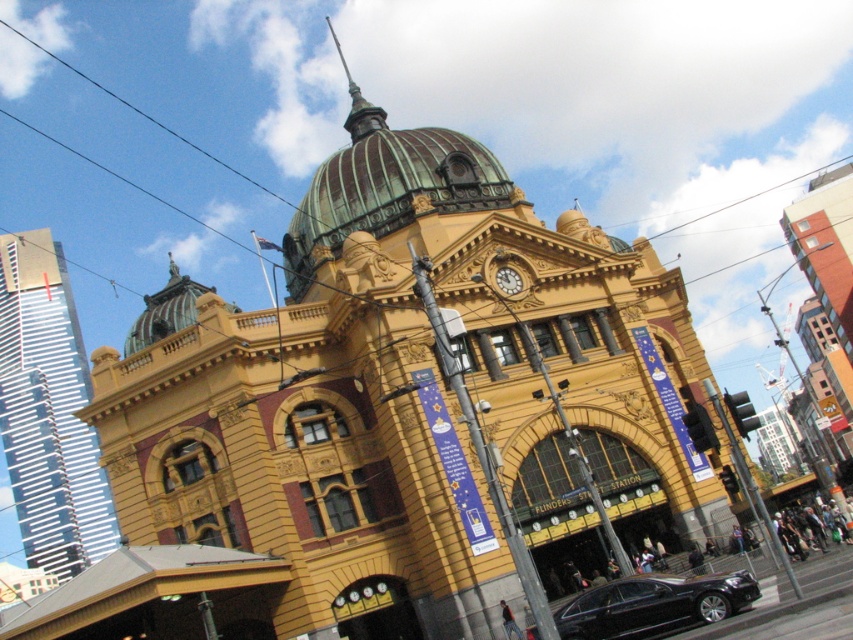
Who is positioned more to the right, green glass dome at upper center or gold metallic clock at center?

From the viewer's perspective, gold metallic clock at center appears more on the right side.

Can you confirm if green glass dome at upper center is thinner than gold metallic clock at center?

A: No, green glass dome at upper center is not thinner than gold metallic clock at center.

Between point (181, 321) and point (514, 269), which one is positioned in front?

Point (514, 269) is in front.

Locate an element on the screen. green glass dome at upper center is located at coordinates (165, 310).

Can you confirm if white glass skyscraper at left is positioned to the right of gold metallic clock at center?

No, white glass skyscraper at left is not to the right of gold metallic clock at center.

Between white glass skyscraper at left and gold metallic clock at center, which one has more height?

With more height is white glass skyscraper at left.

From the picture: Who is more forward, (41, 433) or (520, 285)?

Positioned in front is point (520, 285).

The width and height of the screenshot is (853, 640). In order to click on white glass skyscraper at left in this screenshot , I will do `click(48, 412)`.

Is black glossy sedan at lower center positioned in front of green glass dome at upper center?

Yes, it is in front of green glass dome at upper center.

Is point (735, 600) more distant than point (190, 289)?

No, it is not.

This screenshot has height=640, width=853. I want to click on black glossy sedan at lower center, so click(653, 604).